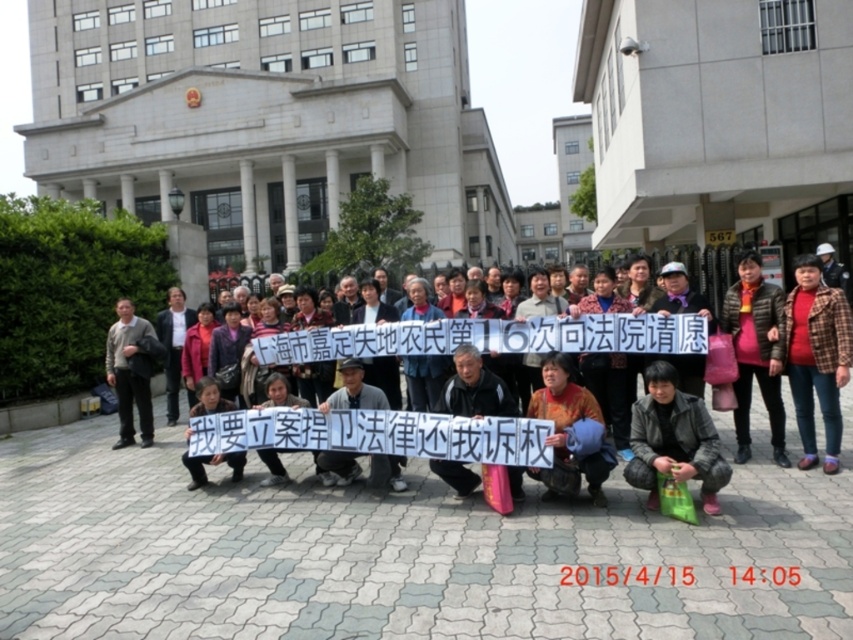
Can you confirm if matte black sign at center is wider than red plaid shirt at center?

Indeed, matte black sign at center has a greater width compared to red plaid shirt at center.

Who is more distant from viewer, (476, 477) or (804, 268)?

Point (804, 268)

Between point (358, 342) and point (805, 337), which one is positioned in front?

Point (805, 337)

I want to click on matte black sign at center, so click(500, 358).

How far apart are red plaid shirt at center and gray sweater at left?

red plaid shirt at center is 26.08 feet from gray sweater at left.

Who is positioned more to the left, red plaid shirt at center or gray sweater at left?

gray sweater at left is more to the left.

The width and height of the screenshot is (853, 640). What do you see at coordinates (816, 356) in the screenshot? I see `red plaid shirt at center` at bounding box center [816, 356].

Locate an element on the screen. Image resolution: width=853 pixels, height=640 pixels. red plaid shirt at center is located at coordinates (816, 356).

Measure the distance between dark gray leather jacket at lower right and gray sweater at left.

6.93 meters

Is point (631, 417) farther from camera compared to point (131, 387)?

That is False.

Where is `dark gray leather jacket at lower right`? The width and height of the screenshot is (853, 640). dark gray leather jacket at lower right is located at coordinates (672, 440).